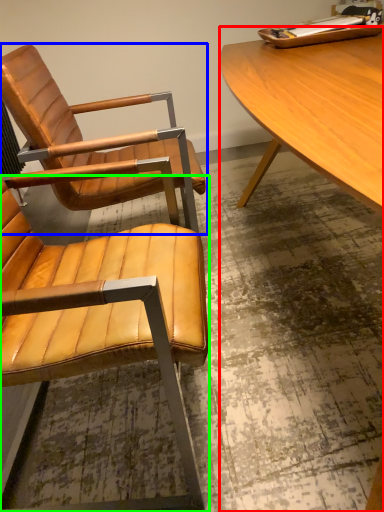
Question: Based on their relative distances, which object is farther from desk (highlighted by a red box)? Choose from chair (highlighted by a blue box) and chair (highlighted by a green box).

Choices:
 (A) chair
 (B) chair

Answer: (B)